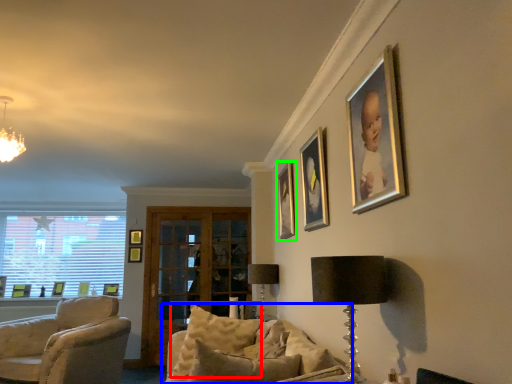
Question: Which object is the closest to the pillow (highlighted by a red box)? Choose among these: studio couch (highlighted by a blue box) or picture frame (highlighted by a green box).

Choices:
 (A) studio couch
 (B) picture frame

Answer: (A)